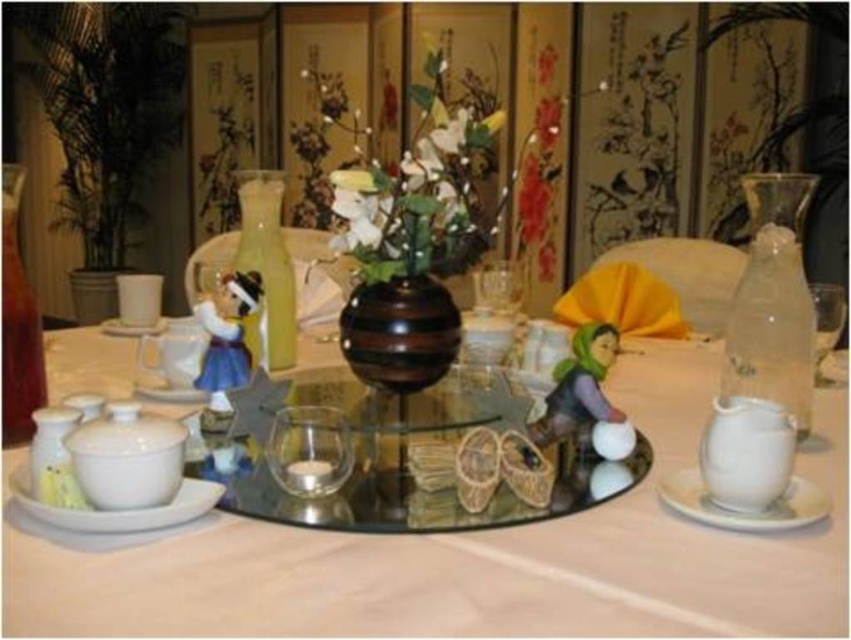
You are a guest at this table and want to reach for the white glossy tea pot at lower right to pour yourself a cup of tea. However, you are seated directly in front of the white ceramic saucer at center. Can you easily reach the tea pot without moving your chair?

The white glossy tea pot at lower right is to the right of the white ceramic saucer at center, so you can easily reach it without needing to move your chair.